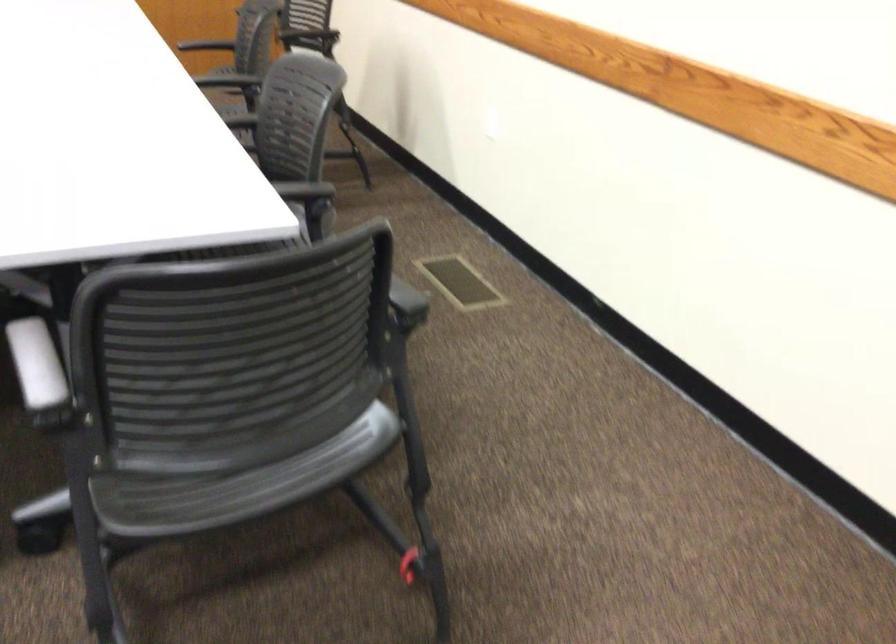
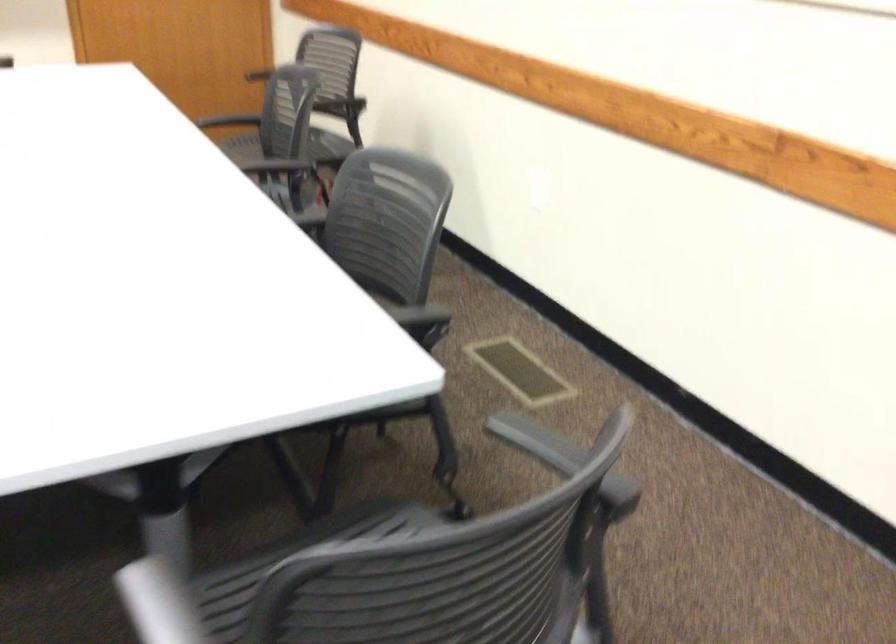
The point at (312, 187) is marked in the first image. Where is the corresponding point in the second image?

(419, 315)